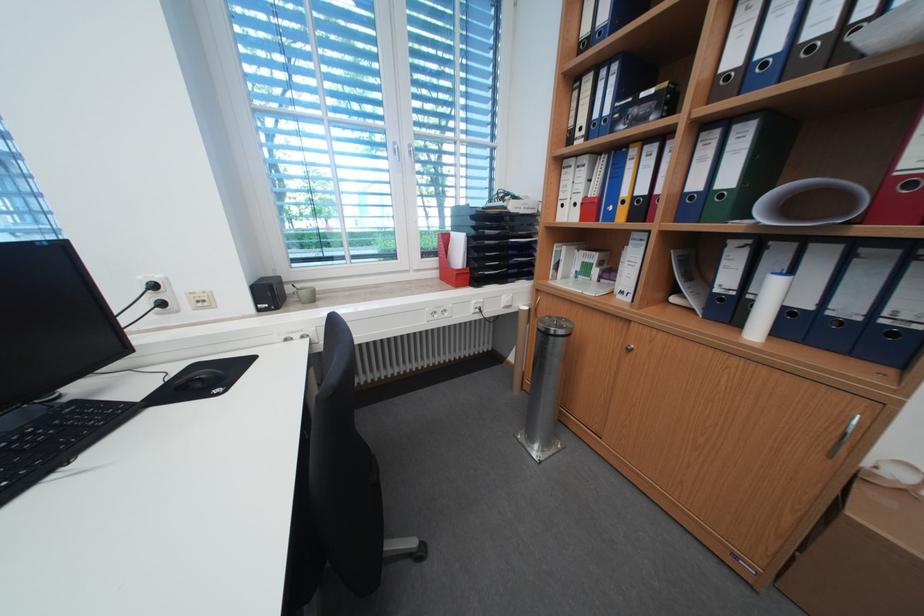
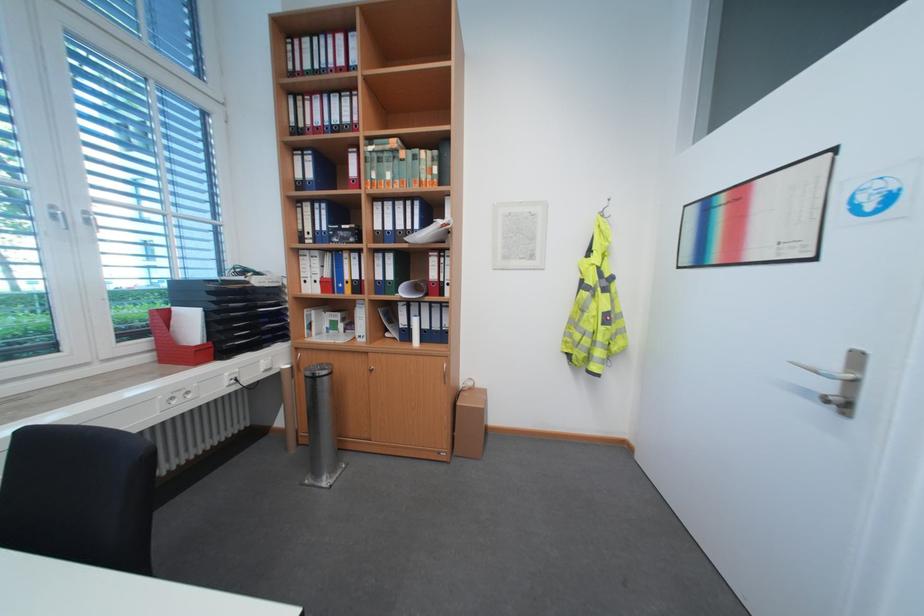
Where in the second image is the point corresponding to (552,326) from the first image?

(319, 374)